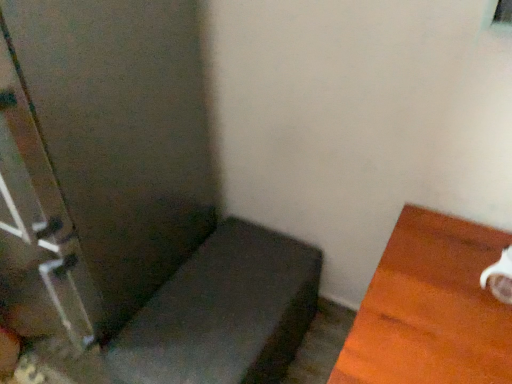
Question: Based on their positions, is matte gray cushion at lower left, which is counted as the 1th furniture, starting from the left, located to the left or right of clear glass screen door at left?

Choices:
 (A) right
 (B) left

Answer: (A)

Question: Looking at the image, does matte gray cushion at lower left, positioned as the 2th furniture in right-to-left order, seem bigger or smaller compared to clear glass screen door at left?

Choices:
 (A) small
 (B) big

Answer: (A)

Question: Based on their relative distances, which object is nearer to the matte gray cushion at lower left, positioned as the 2th furniture in right-to-left order?

Choices:
 (A) clear glass screen door at left
 (B) white glossy mug at right, which is the 2th furniture from left to right

Answer: (A)

Question: Which is farther from the clear glass screen door at left?

Choices:
 (A) white glossy mug at right, which is the 2th furniture from left to right
 (B) matte gray cushion at lower left, which is counted as the 1th furniture, starting from the left

Answer: (A)